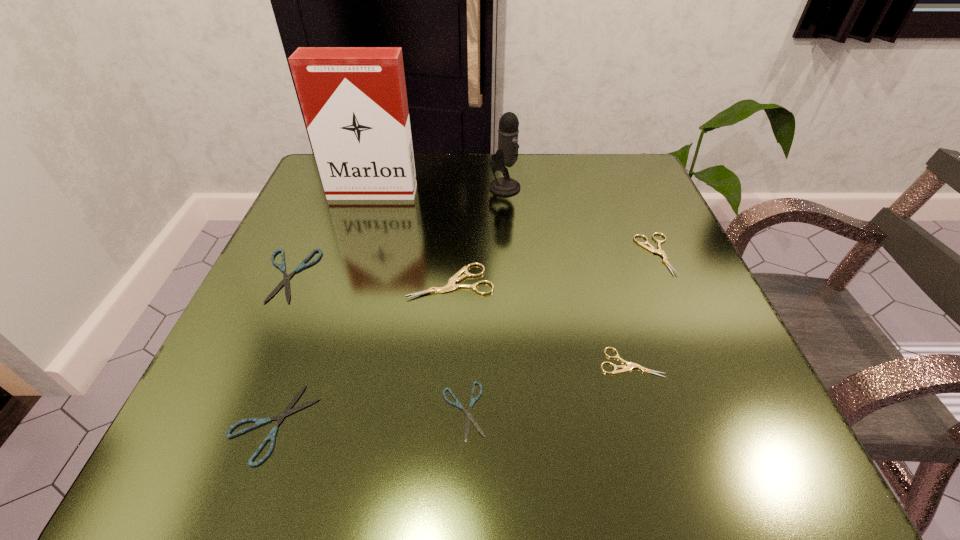
In the image, there is a desktop. At what (x,y) coordinates should I click in order to perform the action: click on free region at the right edge. Please return your answer as a coordinate pair (x, y). Image resolution: width=960 pixels, height=540 pixels. Looking at the image, I should click on (625, 281).

At what (x,y) coordinates should I click in order to perform the action: click on free space at the far left corner of the desktop. Please return your answer as a coordinate pair (x, y). This screenshot has width=960, height=540. Looking at the image, I should click on (313, 192).

Where is `vacant space at the far right corner`? The image size is (960, 540). vacant space at the far right corner is located at coordinates (624, 183).

The width and height of the screenshot is (960, 540). What are the coordinates of `empty space that is in between the rightmost black shears and the second smallest black shears` in the screenshot? It's located at (368, 417).

At what (x,y) coordinates should I click in order to perform the action: click on free space between the biggest black shears and the microphone. Please return your answer as a coordinate pair (x, y). The width and height of the screenshot is (960, 540). Looking at the image, I should click on (396, 231).

The image size is (960, 540). Identify the location of free spot between the leftmost beige shears and the second smallest black shears. (362, 352).

The width and height of the screenshot is (960, 540). I want to click on free space between the microphone and the smallest black shears, so pos(484,299).

You are a GUI agent. You are given a task and a screenshot of the screen. Output one action in this format:
    pyautogui.click(x=<x>, y=<y>)
    Task: Click on the free area in between the farthest black shears and the second smallest black shears
    
    Given the screenshot: What is the action you would take?
    pyautogui.click(x=280, y=349)

Identify the location of free spot between the cigarette_case and the seventh shortest object. The height and width of the screenshot is (540, 960). (439, 190).

The image size is (960, 540). Identify the location of vacant point located between the tallest shears and the seventh shortest object. (478, 234).